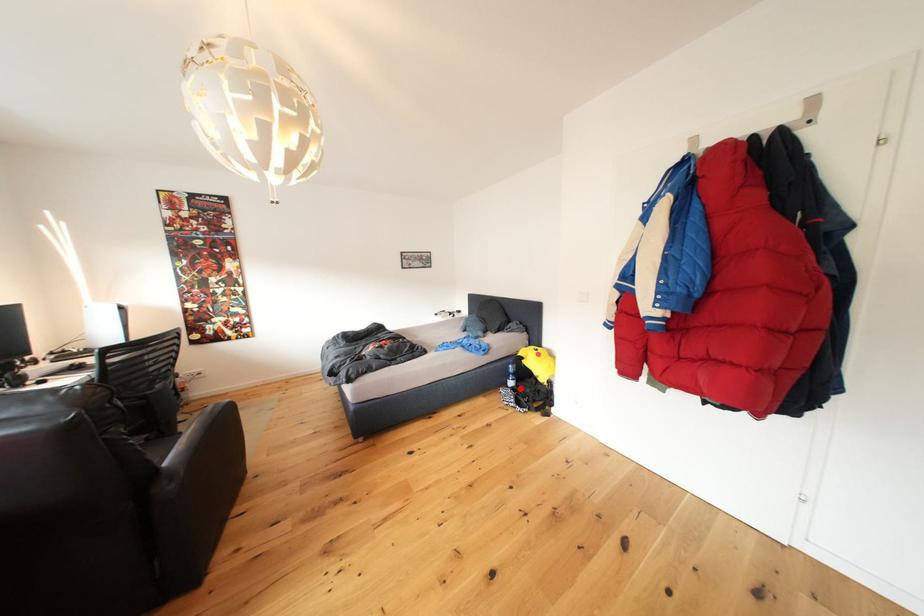
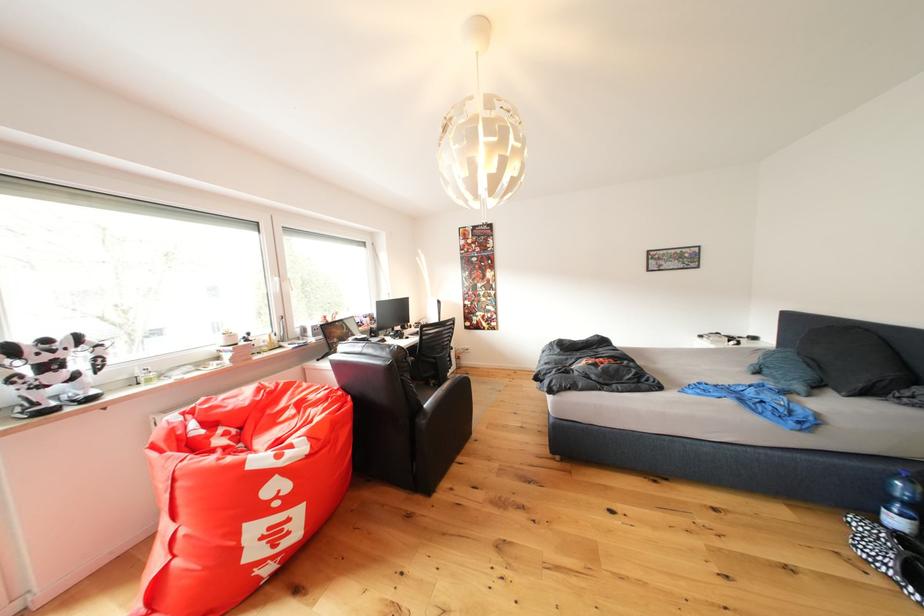
In the second image, find the point that corresponds to the highlighted location in the first image.

(906, 527)